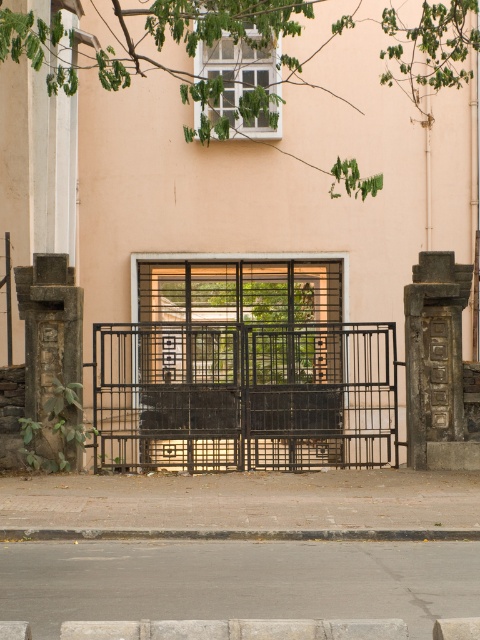
Can you confirm if black metal gate at center is wider than gray concrete pavement at lower center?

Correct, the width of black metal gate at center exceeds that of gray concrete pavement at lower center.

Is black metal gate at center smaller than gray concrete pavement at lower center?

No, black metal gate at center is not smaller than gray concrete pavement at lower center.

I want to click on black metal gate at center, so click(x=243, y=396).

Where is `black metal gate at center`? This screenshot has width=480, height=640. black metal gate at center is located at coordinates (243, 396).

Is gray concrete pavement at lower center closer to camera compared to gray concrete curb at lower center?

Yes.

Which is in front, point (20, 612) or point (210, 529)?

Point (20, 612) is in front.

Locate an element on the screen. gray concrete pavement at lower center is located at coordinates (237, 580).

Measure the distance between black metal gate at center and camera.

black metal gate at center is 51.84 feet away from camera.

Between black metal gate at center and gray concrete curb at lower center, which one has less height?

Standing shorter between the two is gray concrete curb at lower center.

Between point (289, 324) and point (179, 531), which one is positioned behind?

The point (289, 324) is behind.

Find the location of a particular element. black metal gate at center is located at coordinates (243, 396).